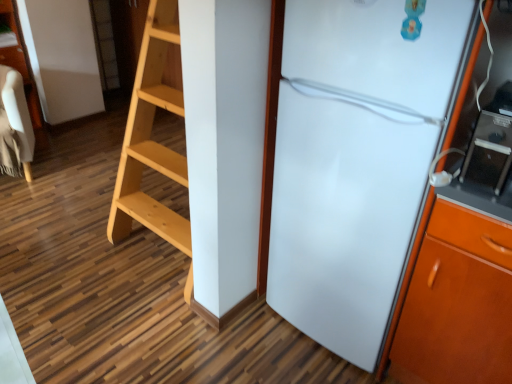
I want to click on black glossy microwave at right, so click(489, 152).

Describe the element at coordinates (489, 152) in the screenshot. I see `black glossy microwave at right` at that location.

The image size is (512, 384). What do you see at coordinates (15, 126) in the screenshot?
I see `beige fabric chair at left` at bounding box center [15, 126].

This screenshot has width=512, height=384. I want to click on black glossy microwave at right, so click(x=489, y=152).

Between point (16, 134) and point (489, 184), which one is positioned in front?

The point (489, 184) is more forward.

From a real-world perspective, who is located higher, beige fabric chair at left or black glossy microwave at right?

black glossy microwave at right, from a real-world perspective.

Does beige fabric chair at left have a lesser width compared to black glossy microwave at right?

No, beige fabric chair at left is not thinner than black glossy microwave at right.

Are beige fabric chair at left and black glossy microwave at right beside each other?

No, beige fabric chair at left is not beside black glossy microwave at right.

From the image's perspective, between black glossy microwave at right and beige fabric chair at left, which one is located above?

beige fabric chair at left, from the image's perspective.

Considering the relative sizes of black glossy microwave at right and beige fabric chair at left in the image provided, is black glossy microwave at right taller than beige fabric chair at left?

Incorrect, the height of black glossy microwave at right is not larger of that of beige fabric chair at left.

Is the surface of black glossy microwave at right in direct contact with beige fabric chair at left?

No, black glossy microwave at right is not in contact with beige fabric chair at left.

Locate an element on the screen. appliance in front of the beige fabric chair at left is located at coordinates (489, 152).

Is point (18, 140) closer to camera compared to point (298, 104)?

No, it is not.

From the image's perspective, is beige fabric chair at left on white glossy refrigerator at right?

Yes, from the image's perspective, beige fabric chair at left is over white glossy refrigerator at right.

At what (x,y) coordinates should I click in order to perform the action: click on refrigerator in front of the beige fabric chair at left. Please return your answer as a coordinate pair (x, y). Image resolution: width=512 pixels, height=384 pixels. Looking at the image, I should click on (360, 159).

Based on the photo, considering the positions of objects beige fabric chair at left and white glossy refrigerator at right in the image provided, who is in front, beige fabric chair at left or white glossy refrigerator at right?

white glossy refrigerator at right.

Relative to beige fabric chair at left, is white glossy refrigerator at right in front or behind?

In the image, white glossy refrigerator at right appears in front of beige fabric chair at left.

Which point is more distant from viewer, (367,110) or (20,108)?

Point (20,108)

Is white glossy refrigerator at right looking in the opposite direction of beige fabric chair at left?

No, white glossy refrigerator at right is not facing away from beige fabric chair at left.

Based on their positions, is white glossy refrigerator at right located to the left or right of beige fabric chair at left?

In the image, white glossy refrigerator at right appears on the right side of beige fabric chair at left.

Is white glossy refrigerator at right looking in the opposite direction of black glossy microwave at right?

No, white glossy refrigerator at right is not facing away from black glossy microwave at right.

Is white glossy refrigerator at right bigger than black glossy microwave at right?

Yes, white glossy refrigerator at right is bigger than black glossy microwave at right.

Can you confirm if white glossy refrigerator at right is shorter than black glossy microwave at right?

In fact, white glossy refrigerator at right may be taller than black glossy microwave at right.

Which object is further away from the camera, black glossy microwave at right or white glossy refrigerator at right?

black glossy microwave at right is further away from the camera.

Does point (466, 162) lie in front of point (316, 165)?

Yes.

Is there a large distance between black glossy microwave at right and white glossy refrigerator at right?

No, black glossy microwave at right is not far from white glossy refrigerator at right.

Is black glossy microwave at right oriented towards white glossy refrigerator at right?

No, black glossy microwave at right is not turned towards white glossy refrigerator at right.

Identify the location of appliance on the right of beige fabric chair at left. The image size is (512, 384). (489, 152).

Where is `furniture on the left of black glossy microwave at right`? Image resolution: width=512 pixels, height=384 pixels. furniture on the left of black glossy microwave at right is located at coordinates (15, 126).

From the image, which object appears to be farther from beige fabric chair at left, white glossy refrigerator at right or black glossy microwave at right?

black glossy microwave at right is further to beige fabric chair at left.

From the image, which object appears to be nearer to black glossy microwave at right, beige fabric chair at left or white glossy refrigerator at right?

white glossy refrigerator at right is positioned closer to the anchor black glossy microwave at right.

Based on their spatial positions, is white glossy refrigerator at right or beige fabric chair at left closer to black glossy microwave at right?

Answer: white glossy refrigerator at right.

Which object lies further to the anchor point white glossy refrigerator at right, beige fabric chair at left or black glossy microwave at right?

beige fabric chair at left is positioned further to the anchor white glossy refrigerator at right.

When comparing their distances from beige fabric chair at left, does black glossy microwave at right or white glossy refrigerator at right seem closer?

The object closer to beige fabric chair at left is white glossy refrigerator at right.

Considering their positions, is black glossy microwave at right positioned closer to white glossy refrigerator at right than beige fabric chair at left?

Among the two, black glossy microwave at right is located nearer to white glossy refrigerator at right.

You are a GUI agent. You are given a task and a screenshot of the screen. Output one action in this format:
    pyautogui.click(x=<x>, y=<y>)
    Task: Click on the refrigerator between beige fabric chair at left and black glossy microwave at right from left to right
    Image resolution: width=512 pixels, height=384 pixels.
    Given the screenshot: What is the action you would take?
    pyautogui.click(x=360, y=159)